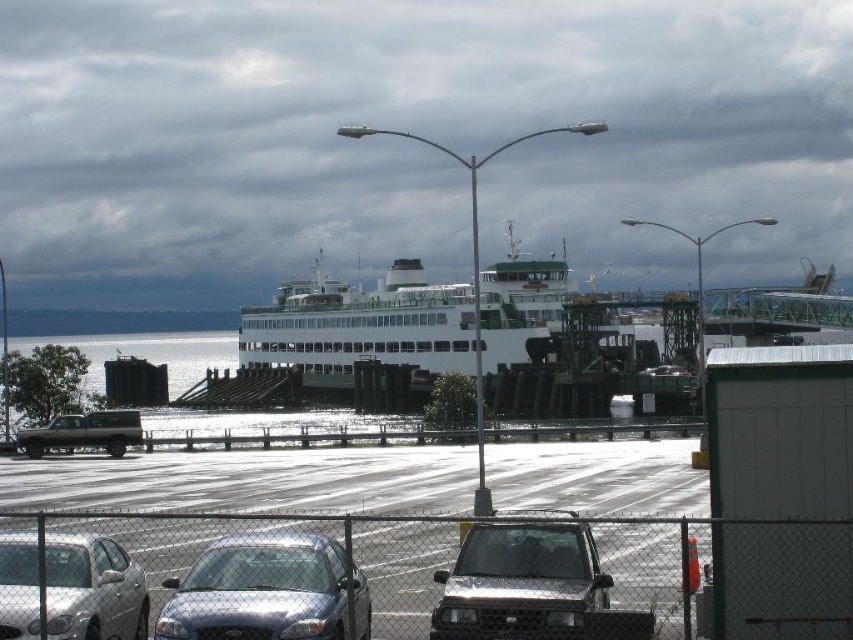
Based on the photo, you are standing at the ferry terminal and want to take a photo of the satin silver sedan at center without including the chain link fence in the background. Where should you position yourself relative to the sedan?

To avoid including the chain link fence in the background when photographing the satin silver sedan at center, position yourself behind the sedan, as it is located at point (267, 589) which places it between you and the fence.

You are a parking attendant at the ferry terminal. You need to park both the shiny silver suv at center and the silver metallic sedan at lower left in a parking spot that is 2 meters wide. Which vehicle will require a wider space?

The shiny silver suv at center requires a wider space because its width surpasses that of the silver metallic sedan at lower left, so it needs a parking spot wider than 2 meters if the sedan fits in 2 meters.

You are a parking attendant at the ferry terminal. You need to park both the satin silver sedan at center and the shiny silver suv at center in a parking spot that can only accommodate vehicles up to 1.8 meters in height. Which vehicle should you prioritize parking first to ensure it fits?

The satin silver sedan at center has a lesser height compared to the shiny silver suv at center. Therefore, you should prioritize parking the satin silver sedan at center first since it is more likely to fit within the 1.8 meters height restriction.